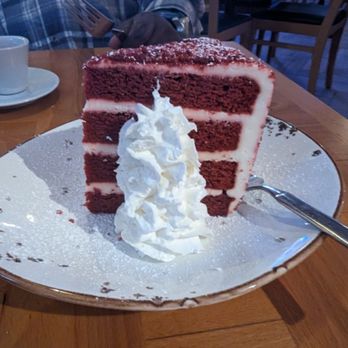
The height and width of the screenshot is (348, 348). I want to click on chair, so click(314, 33), click(244, 30).